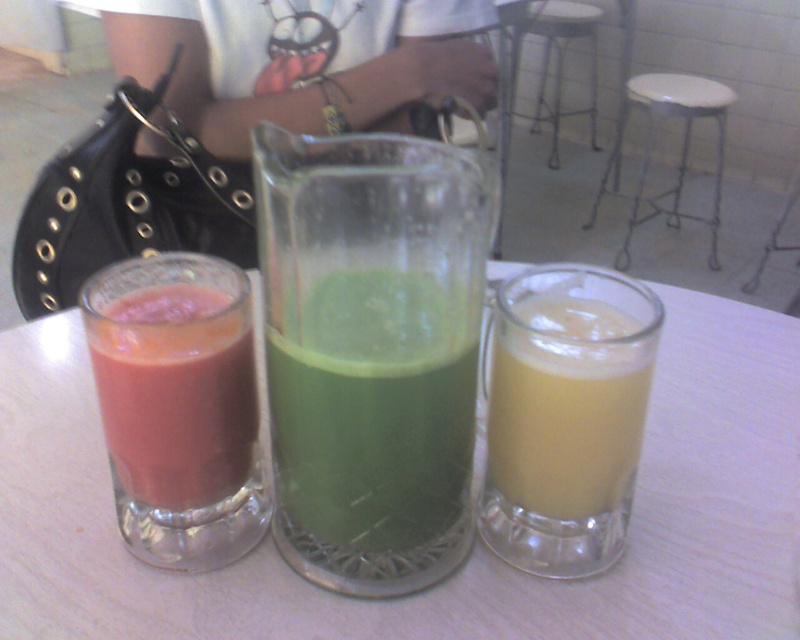
Question: Which point is closer to the camera?

Choices:
 (A) (58, 365)
 (B) (296, 506)

Answer: (B)

Question: Which point appears closest to the camera in this image?

Choices:
 (A) (158, 573)
 (B) (636, 104)

Answer: (A)

Question: Is transparent glass at center smaller than white plastic stool at center?

Choices:
 (A) yes
 (B) no

Answer: (A)

Question: Which of the following is the farthest from the observer?

Choices:
 (A) matte glass at left
 (B) yellow translucent glass at right
 (C) white plastic stool at center

Answer: (C)

Question: Does yellow translucent glass at right appear on the left side of metallic silver stool at lower right?

Choices:
 (A) yes
 (B) no

Answer: (A)

Question: Is yellow translucent glass at right to the left of metallic silver stool at lower right from the viewer's perspective?

Choices:
 (A) yes
 (B) no

Answer: (A)